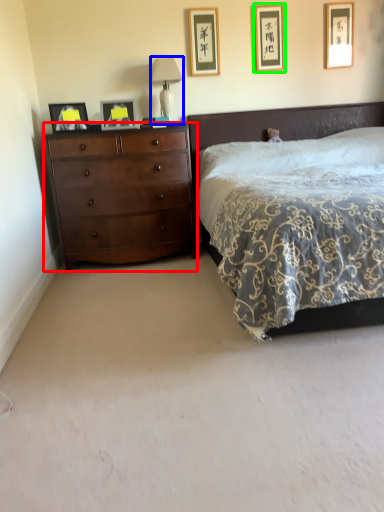
Question: Estimate the real-world distances between objects in this image. Which object is closer to chest of drawers (highlighted by a red box), table lamp (highlighted by a blue box) or picture frame (highlighted by a green box)?

Choices:
 (A) table lamp
 (B) picture frame

Answer: (A)